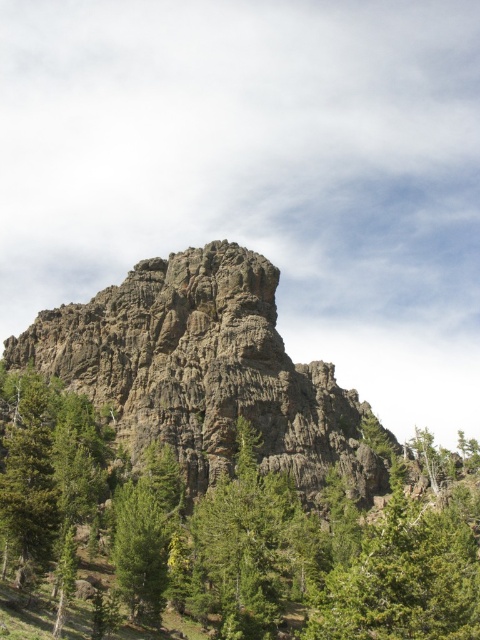
You are a hiker standing at the base of the mountain. You see a green textured tree at center and a rugged stone rock at center. Which object is closer to the ground?

The green textured tree at center is below the rugged stone rock at center, so the green textured tree at center is closer to the ground.

You are a hiker planning to climb the rugged stone rock at center. You notice a green matte tree at lower left nearby. Which object occupies more horizontal space in the image?

The rugged stone rock at center might be wider than green matte tree at lower left according to the description.

You are standing at the base of the mountain and want to reach the point marked at coordinates point (192, 616). Given that the distance from your current position to that point is 216.63 feet, can you estimate how far you need to walk to reach it?

The point (192, 616) is 216.63 feet away from your current position, so you need to walk approximately 216.63 feet to reach it.